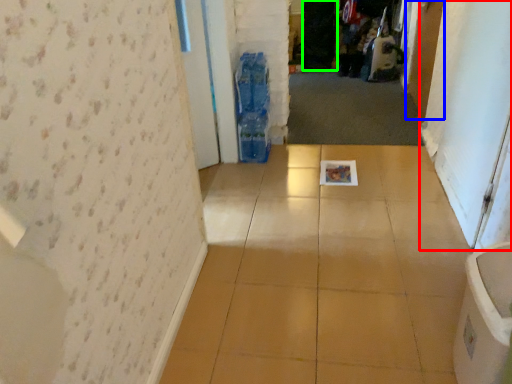
Question: Based on their relative distances, which object is farther from screen door (highlighted by a red box)? Choose from door (highlighted by a blue box) and screen door (highlighted by a green box).

Choices:
 (A) door
 (B) screen door

Answer: (B)